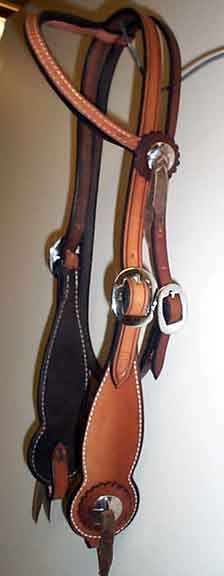
Where is `mirrored`? mirrored is located at coordinates tap(156, 149), tap(112, 504).